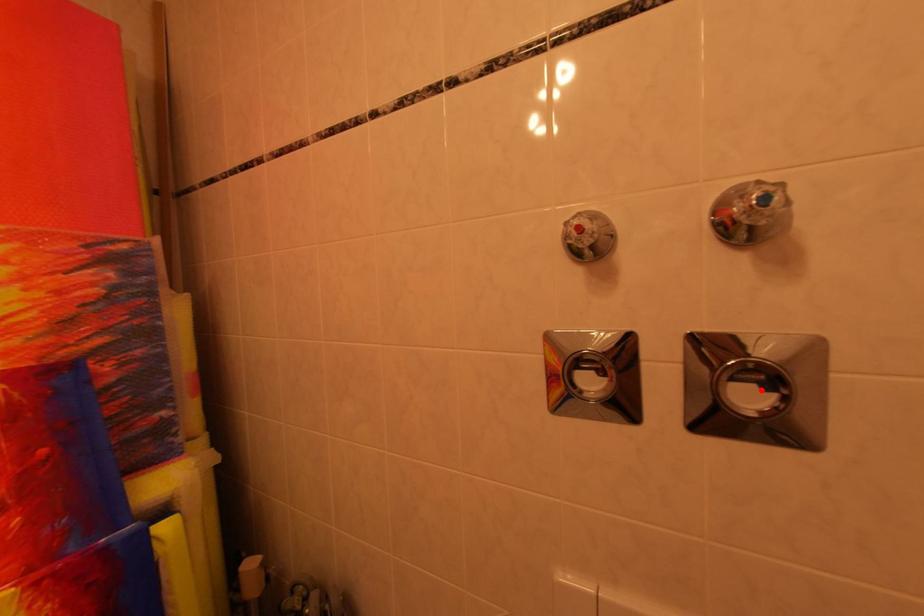
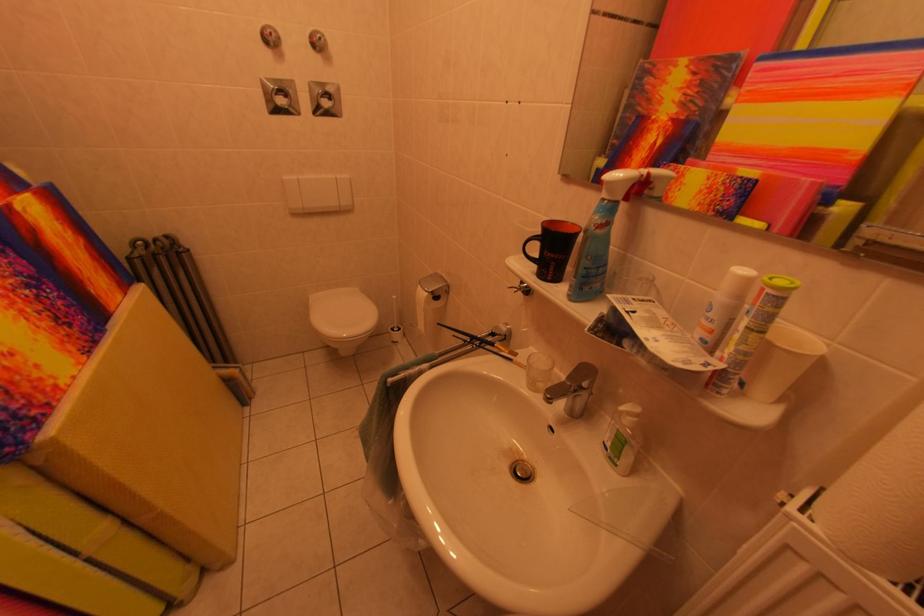
Where in the second image is the point corresponding to the highlighted location from the first image?

(334, 103)